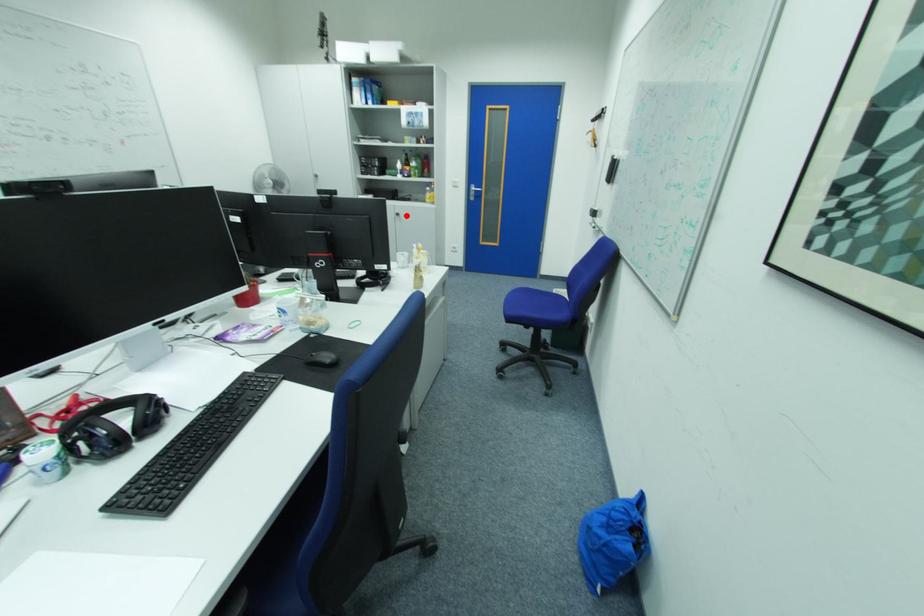
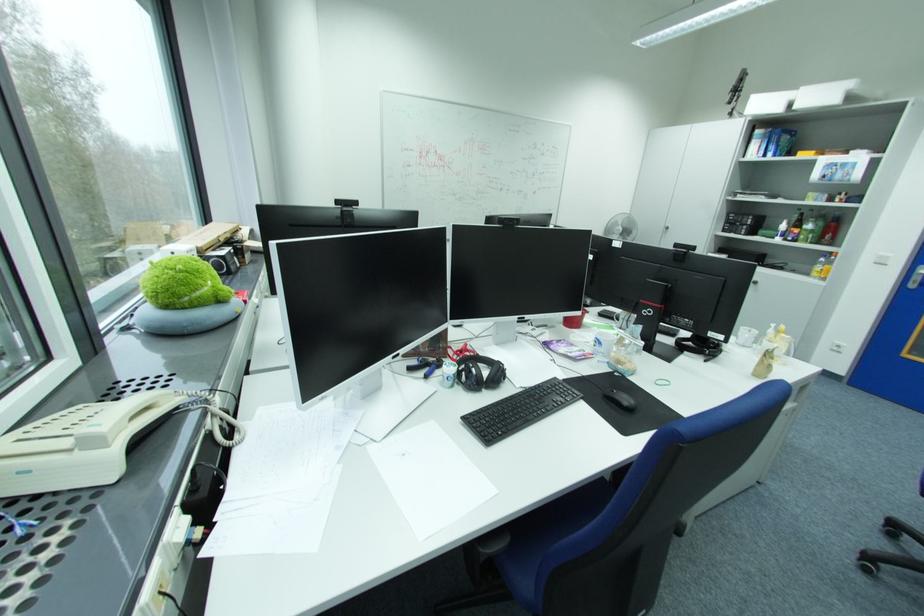
Question: I am providing you with two images of the same scene from different viewpoints. Given a red point in image1, look at the same physical point in image2. Is it:

Choices:
 (A) Closer to the viewpoint
 (B) Farther from the viewpoint

Answer: (A)